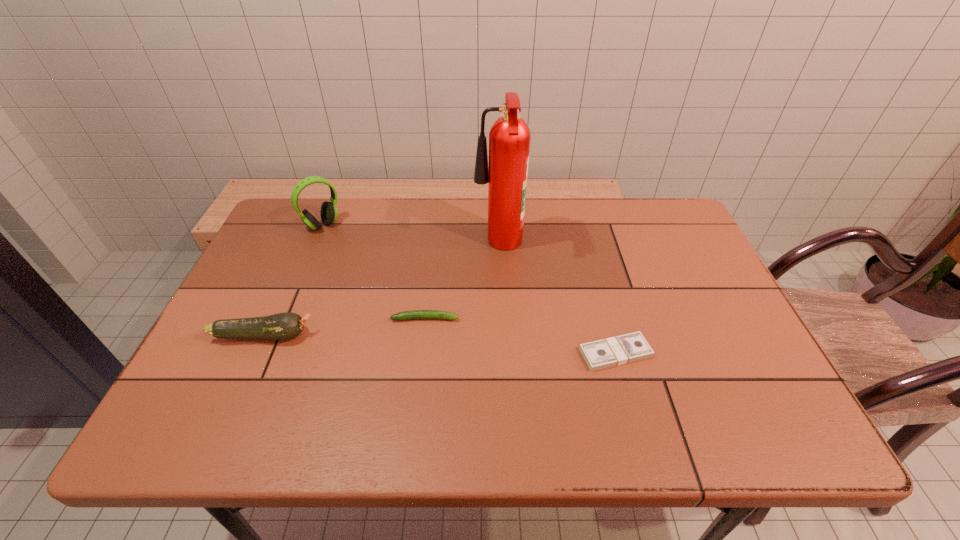
At what (x,y) coordinates should I click in order to perform the action: click on object that is at the far left corner. Please return your answer as a coordinate pair (x, y). This screenshot has height=540, width=960. Looking at the image, I should click on (328, 212).

You are a GUI agent. You are given a task and a screenshot of the screen. Output one action in this format:
    pyautogui.click(x=<x>, y=<y>)
    Task: Click on the vacant space at the far edge of the desktop
    The height and width of the screenshot is (540, 960).
    Given the screenshot: What is the action you would take?
    pyautogui.click(x=425, y=245)

Where is `vacant space at the near edge of the desktop`? vacant space at the near edge of the desktop is located at coordinates (449, 417).

Image resolution: width=960 pixels, height=540 pixels. I want to click on free space at the left edge of the desktop, so click(x=228, y=315).

Locate an element on the screen. vacant position at the right edge of the desktop is located at coordinates click(732, 328).

Where is `vacant region between the farther zucchini and the taller zucchini`? vacant region between the farther zucchini and the taller zucchini is located at coordinates (345, 327).

Where is `unoccupied area between the shorter zucchini and the dollar`? unoccupied area between the shorter zucchini and the dollar is located at coordinates (520, 336).

Identify the location of blank region between the nearer zucchini and the rightmost object. The image size is (960, 540). (440, 344).

I want to click on blank region between the rightmost object and the tallest object, so (x=557, y=300).

Where is `vacant area that lies between the second shortest object and the dollar`? The image size is (960, 540). vacant area that lies between the second shortest object and the dollar is located at coordinates (520, 336).